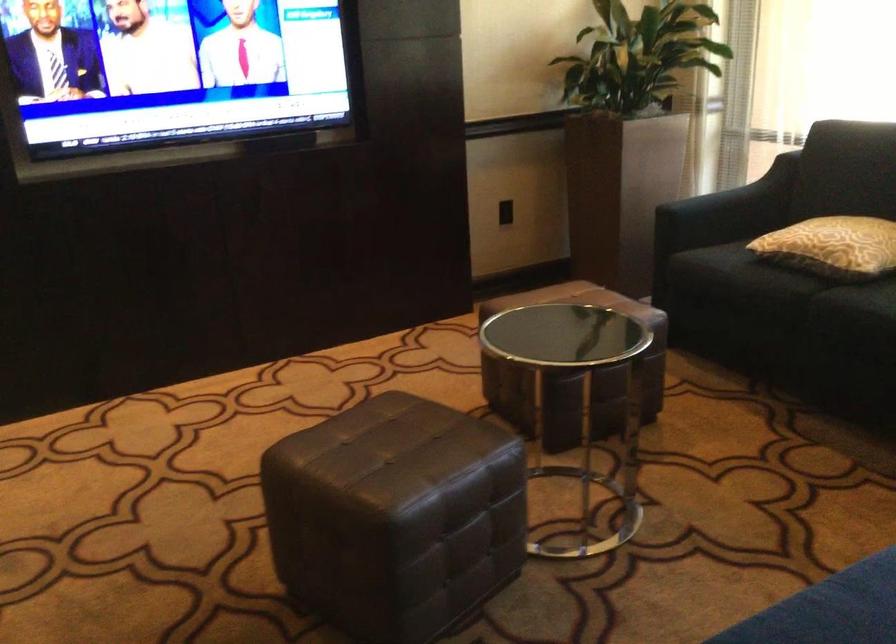
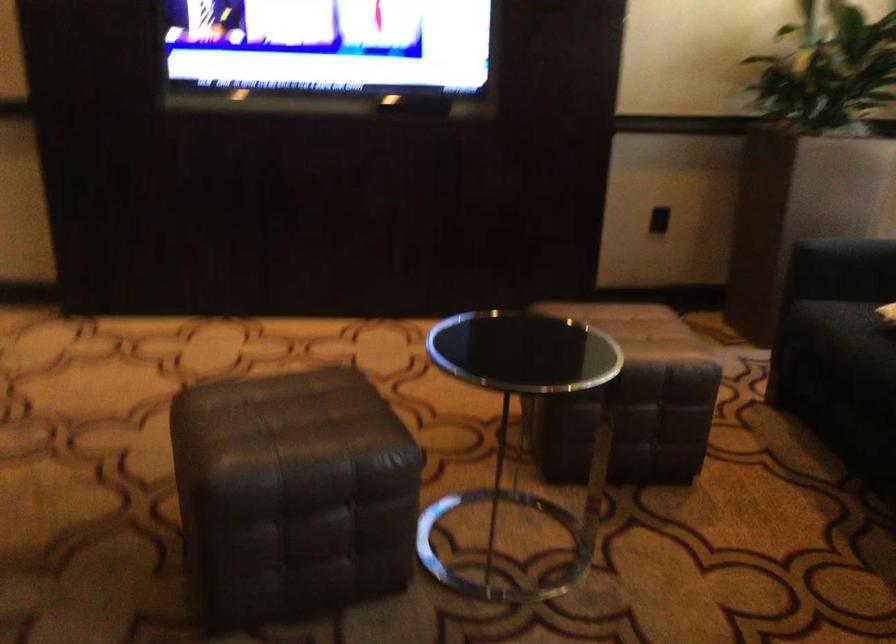
Question: Based on the continuous images, in which direction is the camera rotating? Reply with the corresponding letter.

Choices:
 (A) Left
 (B) Right
 (C) Up
 (D) Down

Answer: (A)